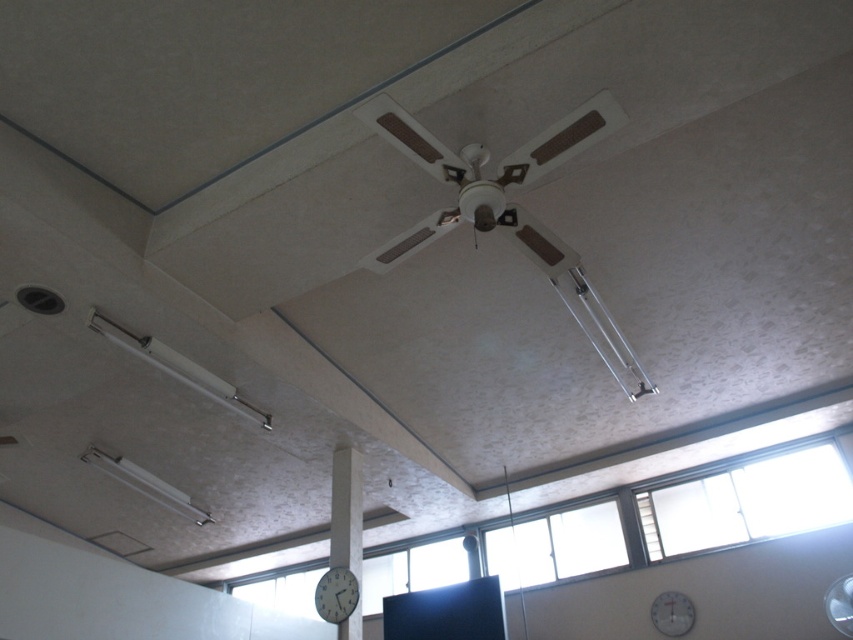
Can you confirm if white concrete clock at center is bigger than white matte clock at center?

Indeed, white concrete clock at center has a larger size compared to white matte clock at center.

Is point (358, 476) positioned after point (666, 618)?

No, it is in front of (666, 618).

Where is `white concrete clock at center`? The image size is (853, 640). white concrete clock at center is located at coordinates (346, 509).

Does white concrete clock at center appear under white plastic fan at upper center?

No.

Is white concrete clock at center taller than white plastic fan at upper center?

Yes, white concrete clock at center is taller than white plastic fan at upper center.

Who is more forward, (344, 525) or (834, 596)?

Point (834, 596)

What are the coordinates of `white concrete clock at center` in the screenshot? It's located at (346, 509).

Does white matte ceiling fan at center appear on the right side of white matte clock at center?

In fact, white matte ceiling fan at center is to the left of white matte clock at center.

Does point (437, 234) come in front of point (657, 608)?

Yes, point (437, 234) is in front of point (657, 608).

Who is more forward, (421, 230) or (679, 602)?

Point (421, 230) is in front.

Where is `white matte ceiling fan at center`? The height and width of the screenshot is (640, 853). white matte ceiling fan at center is located at coordinates (488, 179).